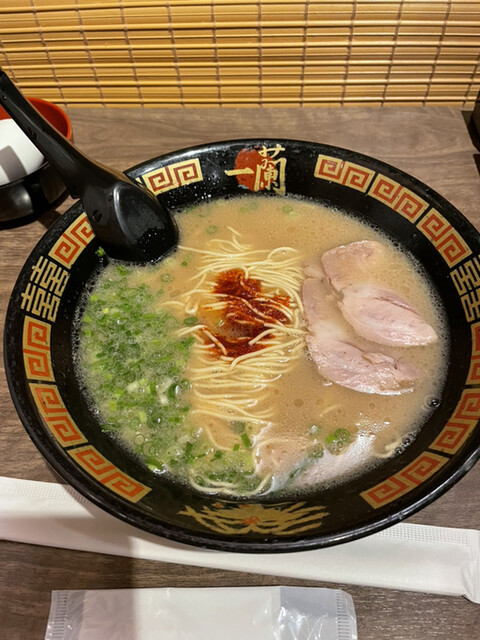
This screenshot has width=480, height=640. I want to click on red circle on the inside rim at the top of the bowl, so click(253, 160).